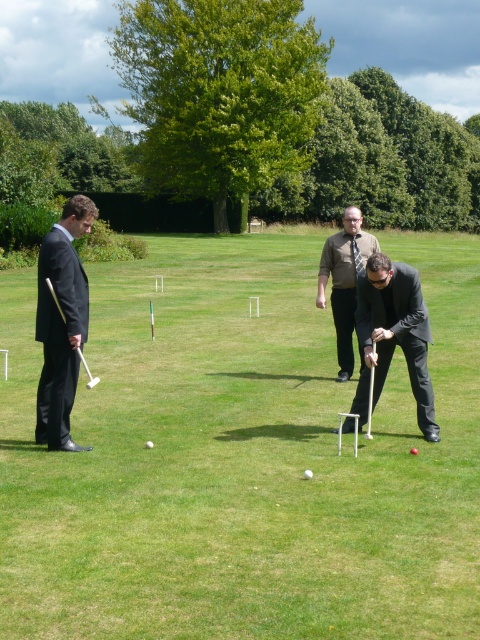
Question: Is the position of black glossy suit at center less distant than that of brown textured shirt at center?

Choices:
 (A) no
 (B) yes

Answer: (B)

Question: Can you confirm if matte black suit at left is bigger than black glossy suit at center?

Choices:
 (A) yes
 (B) no

Answer: (B)

Question: Which point is farther from the camera taking this photo?

Choices:
 (A) (355, 220)
 (B) (384, 314)
 (C) (127, 582)
 (D) (72, 225)

Answer: (A)

Question: Does matte black suit at left have a larger size compared to brown textured shirt at center?

Choices:
 (A) no
 (B) yes

Answer: (A)

Question: Among these points, which one is farthest from the camera?

Choices:
 (A) (76, 212)
 (B) (417, 417)

Answer: (B)

Question: Which of the following is the closest to the observer?

Choices:
 (A) matte black suit at left
 (B) brown textured shirt at center
 (C) black glossy suit at center

Answer: (A)